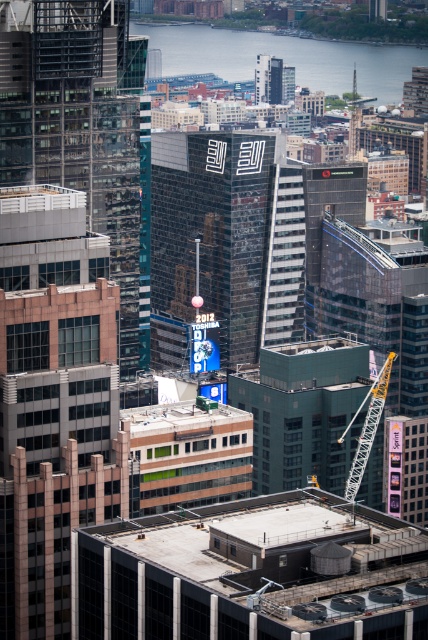
This screenshot has width=428, height=640. Describe the element at coordinates (83, 131) in the screenshot. I see `glassy black skyscraper at center` at that location.

Is point (0, 80) farther from viewer compared to point (386, 376)?

Yes.

At what (x,y) coordinates should I click in order to perform the action: click on glassy black skyscraper at center. Please return your answer as a coordinate pair (x, y). This screenshot has height=640, width=428. Looking at the image, I should click on (83, 131).

Where is `glassy black skyscraper at center`? glassy black skyscraper at center is located at coordinates (83, 131).

The width and height of the screenshot is (428, 640). What do you see at coordinates (285, 58) in the screenshot?
I see `blue glass water at upper center` at bounding box center [285, 58].

Can you confirm if blue glass water at upper center is thinner than yellow metallic crane at center-right?

In fact, blue glass water at upper center might be wider than yellow metallic crane at center-right.

The height and width of the screenshot is (640, 428). In order to click on blue glass water at upper center in this screenshot , I will do `click(285, 58)`.

Consider the image. Who is more forward, (116, 243) or (193, 33)?

Point (116, 243) is in front.

This screenshot has height=640, width=428. What do you see at coordinates (83, 131) in the screenshot?
I see `glassy black skyscraper at center` at bounding box center [83, 131].

Which is in front, point (77, 148) or point (377, 84)?

Point (77, 148) is in front.

I want to click on glassy black skyscraper at center, so click(x=83, y=131).